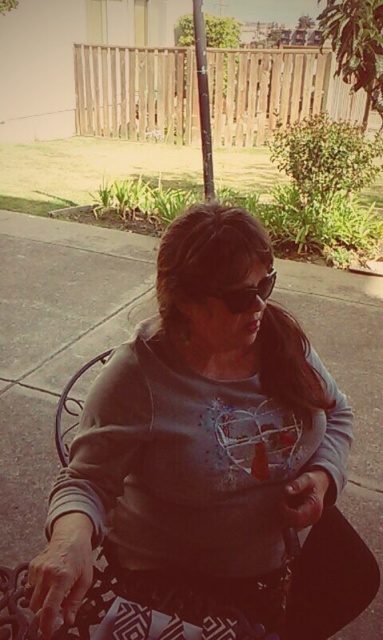
Can you confirm if gray matte sweatshirt at center is positioned to the right of matte black goggles at center?

In fact, gray matte sweatshirt at center is to the left of matte black goggles at center.

Which of these two, gray matte sweatshirt at center or matte black goggles at center, stands taller?

Standing taller between the two is gray matte sweatshirt at center.

You are a GUI agent. You are given a task and a screenshot of the screen. Output one action in this format:
    pyautogui.click(x=<x>, y=<y>)
    Task: Click on the gray matte sweatshirt at center
    
    Given the screenshot: What is the action you would take?
    pyautogui.click(x=196, y=433)

Image resolution: width=383 pixels, height=640 pixels. Identify the location of gray matte sweatshirt at center. (196, 433).